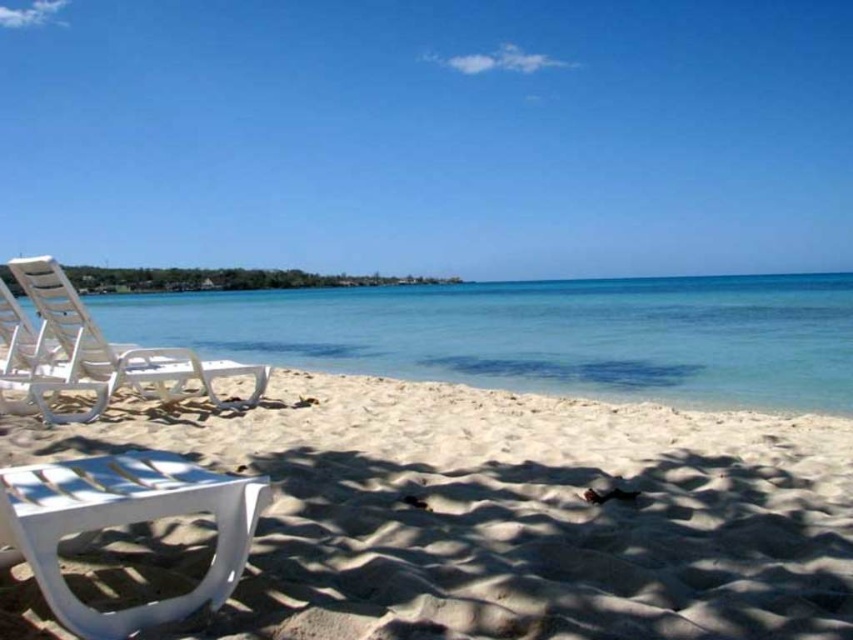
Can you confirm if white plastic chair at lower left is positioned above white plastic beach chair at left?

Incorrect, white plastic chair at lower left is not positioned above white plastic beach chair at left.

From the picture: Is the position of white plastic chair at lower left more distant than that of white plastic beach chair at left?

No, white plastic chair at lower left is in front of white plastic beach chair at left.

What do you see at coordinates (125, 524) in the screenshot?
I see `white plastic chair at lower left` at bounding box center [125, 524].

Locate an element on the screen. The width and height of the screenshot is (853, 640). white plastic chair at lower left is located at coordinates pyautogui.click(x=125, y=524).

From the picture: Is white sand at lower left in front of white plastic beach chair at left?

That is True.

Describe the element at coordinates (509, 513) in the screenshot. This screenshot has height=640, width=853. I see `white sand at lower left` at that location.

Does point (524, 492) come behind point (32, 401)?

No.

The height and width of the screenshot is (640, 853). Find the location of `white sand at lower left`. white sand at lower left is located at coordinates (509, 513).

Between point (212, 630) and point (734, 364), which one is positioned in front?

Point (212, 630) is more forward.

Who is higher up, white sand at lower left or clear blue water at center?

clear blue water at center is above.

Does point (392, 504) lie in front of point (778, 348)?

Yes.

Locate an element on the screen. The height and width of the screenshot is (640, 853). white sand at lower left is located at coordinates tap(509, 513).